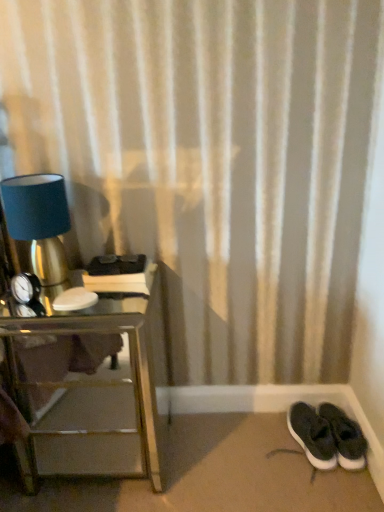
Find the location of `matte blue lampshade at left`. matte blue lampshade at left is located at coordinates (39, 222).

This screenshot has height=512, width=384. In order to click on matte blue lampshade at left in this screenshot , I will do `click(39, 222)`.

In the scene shown: Can you confirm if silver mirrored nightstand at left is wider than matte blue lampshade at left?

Yes, silver mirrored nightstand at left is wider than matte blue lampshade at left.

Which object is positioned more to the right, silver mirrored nightstand at left or matte blue lampshade at left?

silver mirrored nightstand at left.

Is the depth of silver mirrored nightstand at left less than that of matte blue lampshade at left?

Yes.

Considering the positions of objects matte blue lampshade at left and silver mirrored nightstand at left in the image provided, who is in front, matte blue lampshade at left or silver mirrored nightstand at left?

Positioned in front is silver mirrored nightstand at left.

Does matte blue lampshade at left turn towards silver mirrored nightstand at left?

No.

Does point (25, 196) come in front of point (70, 401)?

That is True.

Looking at this image, considering the sizes of matte blue lampshade at left and black suede sneakers at lower right in the image, is matte blue lampshade at left taller or shorter than black suede sneakers at lower right?

In the image, matte blue lampshade at left appears to be taller than black suede sneakers at lower right.

At what (x,y) coordinates should I click in order to perform the action: click on footwear below the matte blue lampshade at left (from the image's perspective). Please return your answer as a coordinate pair (x, y). The width and height of the screenshot is (384, 512). Looking at the image, I should click on (327, 436).

From the image's perspective, is matte blue lampshade at left located beneath black suede sneakers at lower right?

No.

From a real-world perspective, who is located higher, matte blue lampshade at left or black suede sneakers at lower right?

matte blue lampshade at left.

Which is behind, black suede sneakers at lower right or silver mirrored nightstand at left?

black suede sneakers at lower right.

Does black suede sneakers at lower right have a greater width compared to silver mirrored nightstand at left?

In fact, black suede sneakers at lower right might be narrower than silver mirrored nightstand at left.

Does black suede sneakers at lower right turn towards silver mirrored nightstand at left?

No, black suede sneakers at lower right is not turned towards silver mirrored nightstand at left.

Is the surface of black suede sneakers at lower right in direct contact with silver mirrored nightstand at left?

No, black suede sneakers at lower right is not next to silver mirrored nightstand at left.

Considering the points (350, 451) and (51, 284), which point is in front, point (350, 451) or point (51, 284)?

The point (51, 284) is closer.

What's the angular difference between black suede sneakers at lower right and matte blue lampshade at left's facing directions?

The angular difference between black suede sneakers at lower right and matte blue lampshade at left is 11.4 degrees.

Does black suede sneakers at lower right have a smaller size compared to matte blue lampshade at left?

Indeed, black suede sneakers at lower right has a smaller size compared to matte blue lampshade at left.

Does black suede sneakers at lower right turn towards matte blue lampshade at left?

No.

Is point (152, 295) closer or farther from the camera than point (316, 419)?

Clearly, point (152, 295) is more distant from the camera than point (316, 419).

Is silver mirrored nightstand at left bigger or smaller than black suede sneakers at lower right?

Considering their sizes, silver mirrored nightstand at left takes up more space than black suede sneakers at lower right.

The image size is (384, 512). I want to click on nightstand on the left of black suede sneakers at lower right, so click(x=86, y=385).

Identify the location of table lamp on the left of silver mirrored nightstand at left. (39, 222).

Find the location of a particular element. Image resolution: width=384 pixels, height=512 pixels. nightstand in front of the matte blue lampshade at left is located at coordinates (86, 385).

Which object lies nearer to the anchor point matte blue lampshade at left, silver mirrored nightstand at left or black suede sneakers at lower right?

The object closer to matte blue lampshade at left is silver mirrored nightstand at left.

Looking at the image, which one is located further to matte blue lampshade at left, black suede sneakers at lower right or silver mirrored nightstand at left?

black suede sneakers at lower right is further to matte blue lampshade at left.

Looking at the image, which one is located closer to silver mirrored nightstand at left, matte blue lampshade at left or black suede sneakers at lower right?

A: The object closer to silver mirrored nightstand at left is matte blue lampshade at left.

When comparing their distances from silver mirrored nightstand at left, does black suede sneakers at lower right or matte blue lampshade at left seem further?

Among the two, black suede sneakers at lower right is located further to silver mirrored nightstand at left.

Based on their spatial positions, is matte blue lampshade at left or silver mirrored nightstand at left closer to black suede sneakers at lower right?

Among the two, silver mirrored nightstand at left is located nearer to black suede sneakers at lower right.

Looking at the image, which one is located further to black suede sneakers at lower right, silver mirrored nightstand at left or matte blue lampshade at left?

matte blue lampshade at left.

Where is `nightstand between matte blue lampshade at left and black suede sneakers at lower right from left to right`? nightstand between matte blue lampshade at left and black suede sneakers at lower right from left to right is located at coordinates click(x=86, y=385).